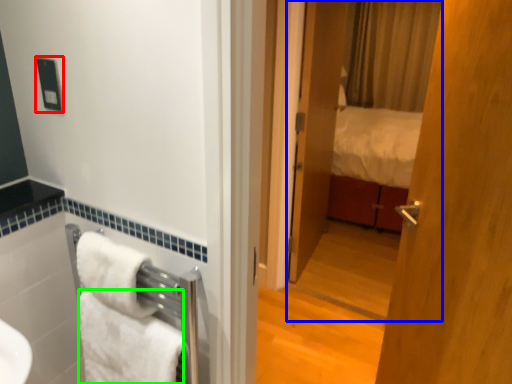
Question: Which object is positioned closest to electric outlet (highlighted by a red box)? Select from mirror (highlighted by a blue box) and towel/napkin (highlighted by a green box).

Choices:
 (A) mirror
 (B) towel/napkin

Answer: (B)